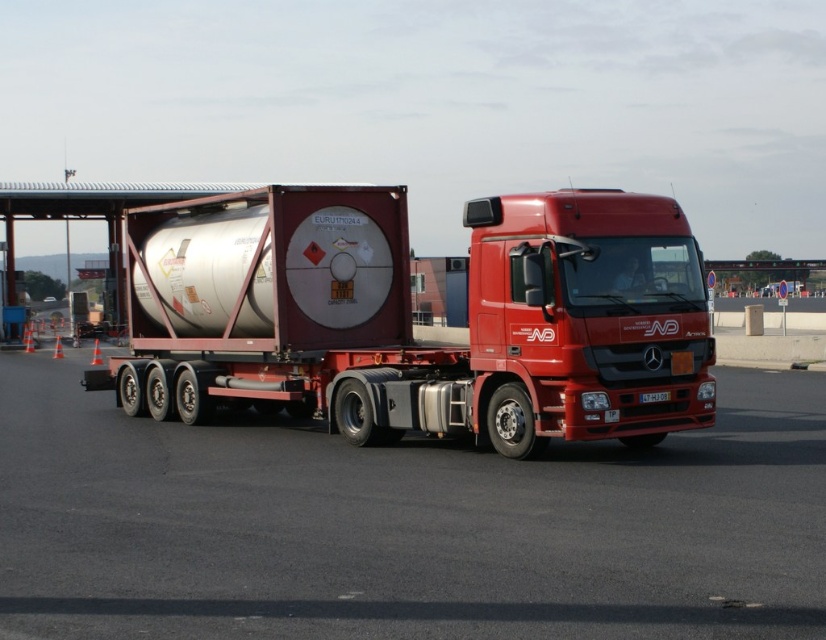
Question: Which of the following is the closest to the observer?

Choices:
 (A) metallic silver tank at center
 (B) metallic asphalt at center

Answer: (B)

Question: Which object appears farthest from the camera in this image?

Choices:
 (A) metallic silver tank at center
 (B) metallic asphalt at center

Answer: (A)

Question: Where is metallic asphalt at center located in relation to metallic silver tank at center in the image?

Choices:
 (A) above
 (B) below

Answer: (B)

Question: Considering the relative positions of metallic asphalt at center and metallic silver tank at center in the image provided, where is metallic asphalt at center located with respect to metallic silver tank at center?

Choices:
 (A) below
 (B) above

Answer: (A)

Question: Which of the following is the closest to the observer?

Choices:
 (A) (164, 506)
 (B) (496, 339)

Answer: (A)

Question: Does metallic asphalt at center lie behind metallic silver tank at center?

Choices:
 (A) yes
 (B) no

Answer: (B)